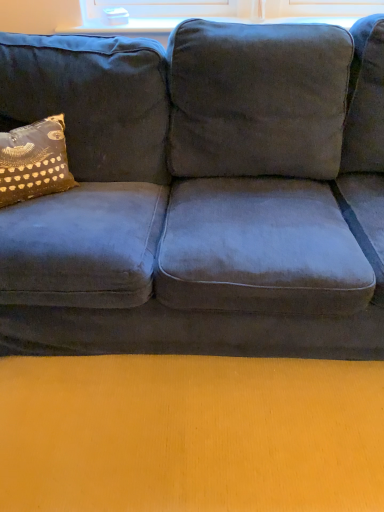
Locate an element on the screen. The width and height of the screenshot is (384, 512). gold-patterned fabric pillow at left is located at coordinates (34, 161).

Describe the element at coordinates (34, 161) in the screenshot. I see `gold-patterned fabric pillow at left` at that location.

In order to face glassy white window sill at upper center, should I rotate leftwards or rightwards?

To align with it, rotate right about 2.927°.

The width and height of the screenshot is (384, 512). What do you see at coordinates (125, 26) in the screenshot?
I see `glassy white window sill at upper center` at bounding box center [125, 26].

What is the approximate width of glassy white window sill at upper center?

The width of glassy white window sill at upper center is 6.31 inches.

The width and height of the screenshot is (384, 512). I want to click on glassy white window sill at upper center, so point(125,26).

Where is `gold-patterned fabric pillow at left`? Image resolution: width=384 pixels, height=512 pixels. gold-patterned fabric pillow at left is located at coordinates (34, 161).

Between gold-patterned fabric pillow at left and glassy white window sill at upper center, which one appears on the left side from the viewer's perspective?

Positioned to the left is gold-patterned fabric pillow at left.

Which object is more forward, gold-patterned fabric pillow at left or glassy white window sill at upper center?

gold-patterned fabric pillow at left is more forward.

Considering the points (16, 168) and (99, 23), which point is behind, point (16, 168) or point (99, 23)?

The point (99, 23) is behind.

From the image's perspective, is gold-patterned fabric pillow at left below glassy white window sill at upper center?

Yes, from the image's perspective, gold-patterned fabric pillow at left is beneath glassy white window sill at upper center.

From a real-world perspective, between gold-patterned fabric pillow at left and glassy white window sill at upper center, who is vertically higher?

In real-world perspective, glassy white window sill at upper center is above.

Does gold-patterned fabric pillow at left have a lesser width compared to glassy white window sill at upper center?

Incorrect, the width of gold-patterned fabric pillow at left is not less than that of glassy white window sill at upper center.

Who is taller, gold-patterned fabric pillow at left or glassy white window sill at upper center?

gold-patterned fabric pillow at left.

Who is bigger, gold-patterned fabric pillow at left or glassy white window sill at upper center?

With larger size is gold-patterned fabric pillow at left.

From the picture: Can glassy white window sill at upper center be found inside gold-patterned fabric pillow at left?

No, glassy white window sill at upper center is not inside gold-patterned fabric pillow at left.

Are gold-patterned fabric pillow at left and glassy white window sill at upper center beside each other?

No, gold-patterned fabric pillow at left is not beside glassy white window sill at upper center.

Is gold-patterned fabric pillow at left looking in the opposite direction of glassy white window sill at upper center?

That's not correct — gold-patterned fabric pillow at left is not looking away from glassy white window sill at upper center.

I want to click on pillow in front of the glassy white window sill at upper center, so click(x=34, y=161).

Considering the relative positions of glassy white window sill at upper center and gold-patterned fabric pillow at left in the image provided, is glassy white window sill at upper center to the right of gold-patterned fabric pillow at left from the viewer's perspective?

Indeed, glassy white window sill at upper center is positioned on the right side of gold-patterned fabric pillow at left.

Considering the relative positions of glassy white window sill at upper center and gold-patterned fabric pillow at left in the image provided, is glassy white window sill at upper center in front of gold-patterned fabric pillow at left?

No, the depth of glassy white window sill at upper center is greater than that of gold-patterned fabric pillow at left.

Considering the points (94, 24) and (52, 123), which point is in front, point (94, 24) or point (52, 123)?

Point (52, 123)

From the image's perspective, is glassy white window sill at upper center below gold-patterned fabric pillow at left?

Incorrect, from the image's perspective, glassy white window sill at upper center is higher than gold-patterned fabric pillow at left.

From a real-world perspective, is glassy white window sill at upper center below gold-patterned fabric pillow at left?

No, from a real-world perspective, glassy white window sill at upper center is not beneath gold-patterned fabric pillow at left.

Is glassy white window sill at upper center thinner than gold-patterned fabric pillow at left?

Yes, glassy white window sill at upper center is thinner than gold-patterned fabric pillow at left.

Consider the image. Considering the relative sizes of glassy white window sill at upper center and gold-patterned fabric pillow at left in the image provided, is glassy white window sill at upper center shorter than gold-patterned fabric pillow at left?

Correct, glassy white window sill at upper center is not as tall as gold-patterned fabric pillow at left.

Can you confirm if glassy white window sill at upper center is smaller than gold-patterned fabric pillow at left?

Yes.

Is glassy white window sill at upper center positioned beyond the bounds of gold-patterned fabric pillow at left?

Yes, glassy white window sill at upper center is outside of gold-patterned fabric pillow at left.

Is glassy white window sill at upper center far from gold-patterned fabric pillow at left?

Actually, glassy white window sill at upper center and gold-patterned fabric pillow at left are a little close together.

Is glassy white window sill at upper center turned away from gold-patterned fabric pillow at left?

No.

How many degrees apart are the facing directions of glassy white window sill at upper center and gold-patterned fabric pillow at left?

45.8 degrees separate the facing orientations of glassy white window sill at upper center and gold-patterned fabric pillow at left.

Identify the location of window sill that appears above the gold-patterned fabric pillow at left (from the image's perspective). 125,26.

Locate an element on the screen. pillow in front of the glassy white window sill at upper center is located at coordinates (34, 161).

I want to click on window sill on the right of the gold-patterned fabric pillow at left, so click(125, 26).